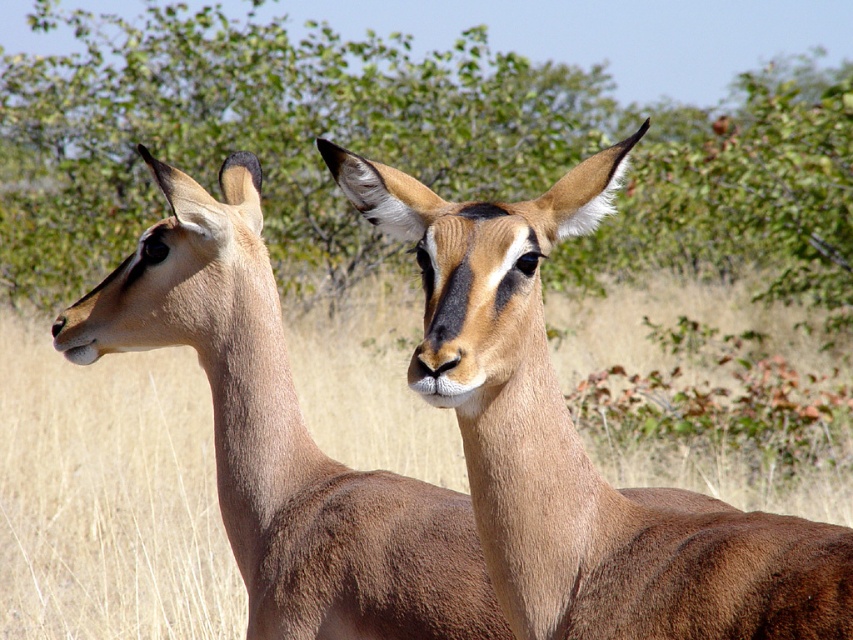
Does green leafy tree at upper center appear under brown smooth antelope at center?

Incorrect, green leafy tree at upper center is not positioned below brown smooth antelope at center.

Where is `green leafy tree at upper center`? The height and width of the screenshot is (640, 853). green leafy tree at upper center is located at coordinates (264, 132).

The width and height of the screenshot is (853, 640). I want to click on green leafy tree at upper center, so click(x=264, y=132).

Does green leafy tree at upper center have a larger size compared to brown fur antelope at center?

Yes, green leafy tree at upper center is bigger than brown fur antelope at center.

Does green leafy tree at upper center appear on the left side of brown fur antelope at center?

Yes, green leafy tree at upper center is to the left of brown fur antelope at center.

I want to click on green leafy tree at upper center, so point(264,132).

Can you confirm if brown smooth antelope at center is positioned to the right of brown fur antelope at center?

Correct, you'll find brown smooth antelope at center to the right of brown fur antelope at center.

Can you confirm if brown smooth antelope at center is positioned below brown fur antelope at center?

No.

Describe the element at coordinates (576, 440) in the screenshot. I see `brown smooth antelope at center` at that location.

Identify the location of brown smooth antelope at center. This screenshot has width=853, height=640. (576, 440).